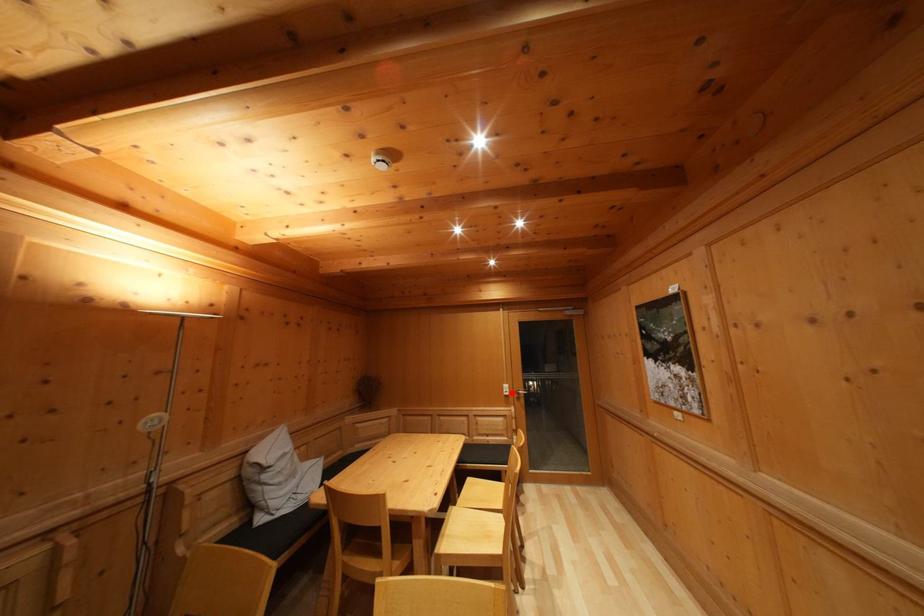
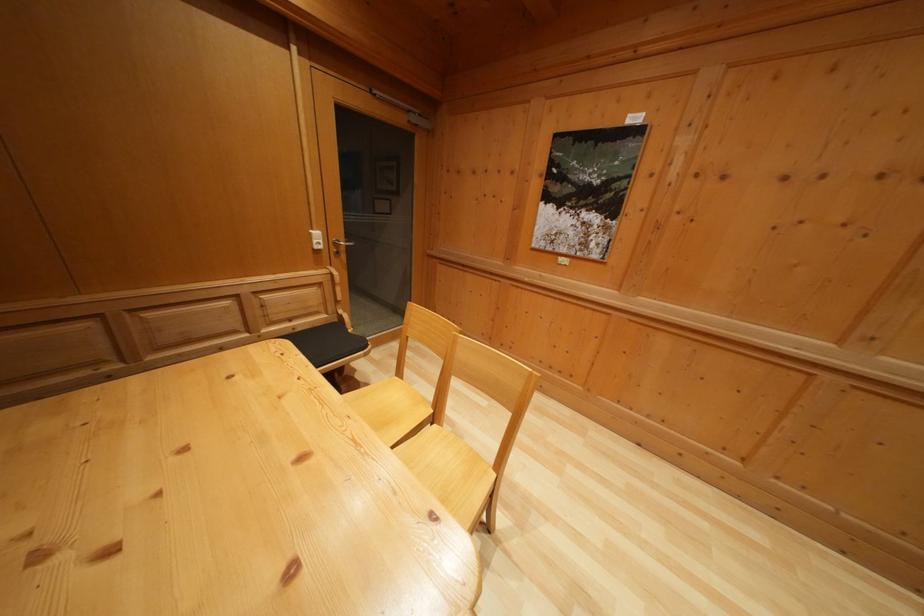
Question: I am providing you with two images of the same scene from different viewpoints. Image1 has a red point marked. In image2, the corresponding 3D location appears at what relative position? Reply with the corresponding letter.

Choices:
 (A) Closer
 (B) Farther

Answer: (A)